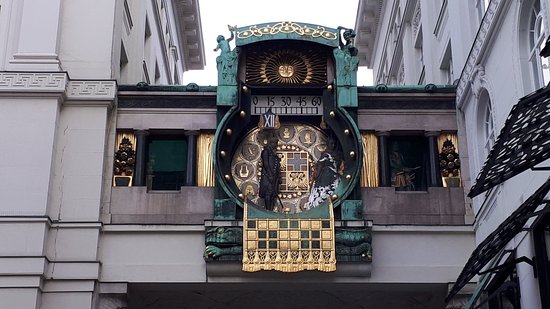
Find the location of `clock`. clock is located at coordinates (298, 168).